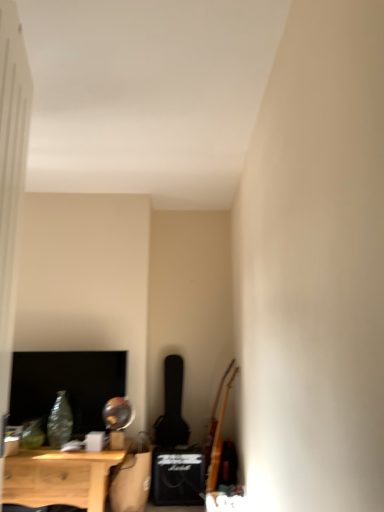
Question: Considering the positions of wooden acoustic guitar at right and light wood nightstand at lower left in the image, is wooden acoustic guitar at right taller or shorter than light wood nightstand at lower left?

Choices:
 (A) tall
 (B) short

Answer: (A)

Question: Is wooden acoustic guitar at right spatially inside light wood nightstand at lower left, or outside of it?

Choices:
 (A) inside
 (B) outside

Answer: (B)

Question: From a real-world perspective, is wooden acoustic guitar at right physically located above or below light wood nightstand at lower left?

Choices:
 (A) below
 (B) above

Answer: (B)

Question: Is light wood nightstand at lower left wider or thinner than wooden acoustic guitar at right?

Choices:
 (A) thin
 (B) wide

Answer: (B)

Question: Would you say light wood nightstand at lower left is inside or outside wooden acoustic guitar at right?

Choices:
 (A) outside
 (B) inside

Answer: (A)

Question: From the image's perspective, is light wood nightstand at lower left positioned above or below wooden acoustic guitar at right?

Choices:
 (A) below
 (B) above

Answer: (A)

Question: In the image, is light wood nightstand at lower left positioned in front of or behind wooden acoustic guitar at right?

Choices:
 (A) front
 (B) behind

Answer: (A)